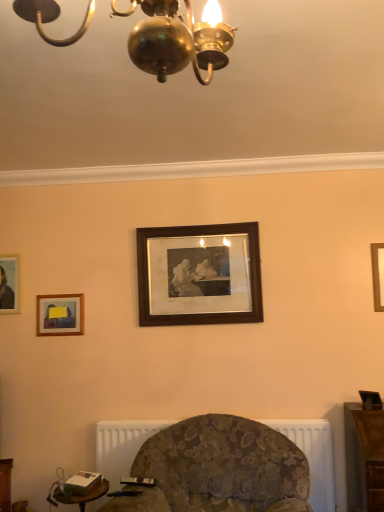
Question: Looking at their shapes, would you say white textured radiator at lower center is wider or thinner than white plastic table at lower left?

Choices:
 (A) thin
 (B) wide

Answer: (A)

Question: From a real-world perspective, is white textured radiator at lower center physically located above or below white plastic table at lower left?

Choices:
 (A) above
 (B) below

Answer: (A)

Question: Considering the real-world distances, which object is farthest from the white plastic table at lower left?

Choices:
 (A) matte gold picture frame at upper left, the 3th picture frame positioned from the right
 (B) wooden picture frame at right, which appears as the 4th picture frame when viewed from the left
 (C) white textured radiator at lower center
 (D) brown wooden picture frame at center, which is counted as the 3th picture frame, starting from the left
 (E) wooden picture frame at left, which is the first picture frame in left-to-right order

Answer: (B)

Question: Considering the real-world distances, which object is farthest from the wooden picture frame at right, which appears as the 4th picture frame when viewed from the left?

Choices:
 (A) white textured radiator at lower center
 (B) matte gold picture frame at upper left, the 3th picture frame positioned from the right
 (C) wooden picture frame at left, which is the first picture frame in left-to-right order
 (D) brown wooden picture frame at center, which appears as the 2th picture frame when viewed from the right
 (E) white plastic table at lower left

Answer: (C)